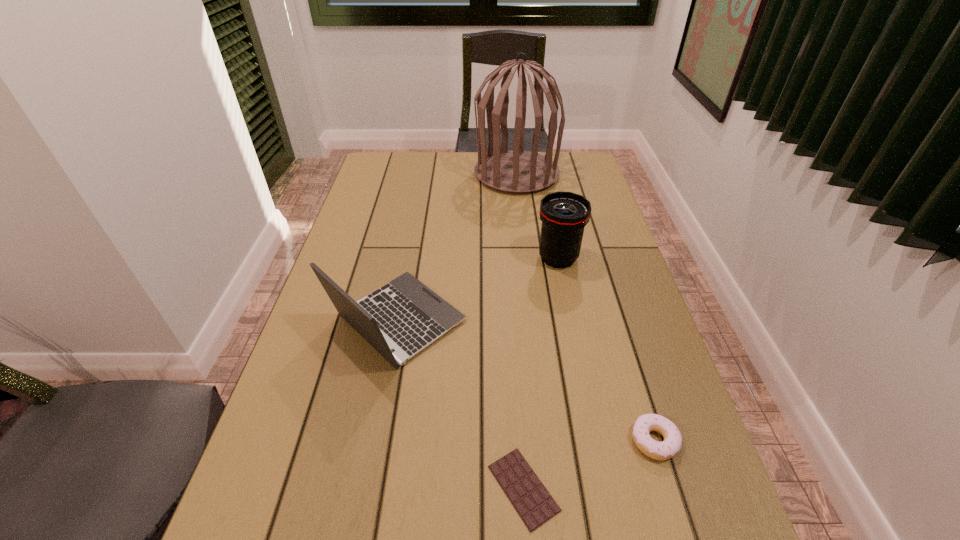
Image resolution: width=960 pixels, height=540 pixels. Find the location of `the farthest object`. the farthest object is located at coordinates (516, 171).

Find the location of a particular element. the tallest object is located at coordinates (516, 171).

Locate an element on the screen. laptop_computer is located at coordinates (406, 316).

Where is `the third farthest object`? The width and height of the screenshot is (960, 540). the third farthest object is located at coordinates (406, 316).

Find the location of `the second farthest object`. the second farthest object is located at coordinates (564, 215).

This screenshot has height=540, width=960. Identify the location of doughnut. (672, 443).

What are the coordinates of `the fourth tallest object` in the screenshot? It's located at (672, 443).

This screenshot has width=960, height=540. In order to click on chocolate bar in this screenshot , I will do `click(534, 504)`.

Identify the location of vacant region located on the left of the tallest object. (431, 174).

Locate an element on the screen. blank space located 0.280m at the front screen of the leftmost object is located at coordinates (580, 321).